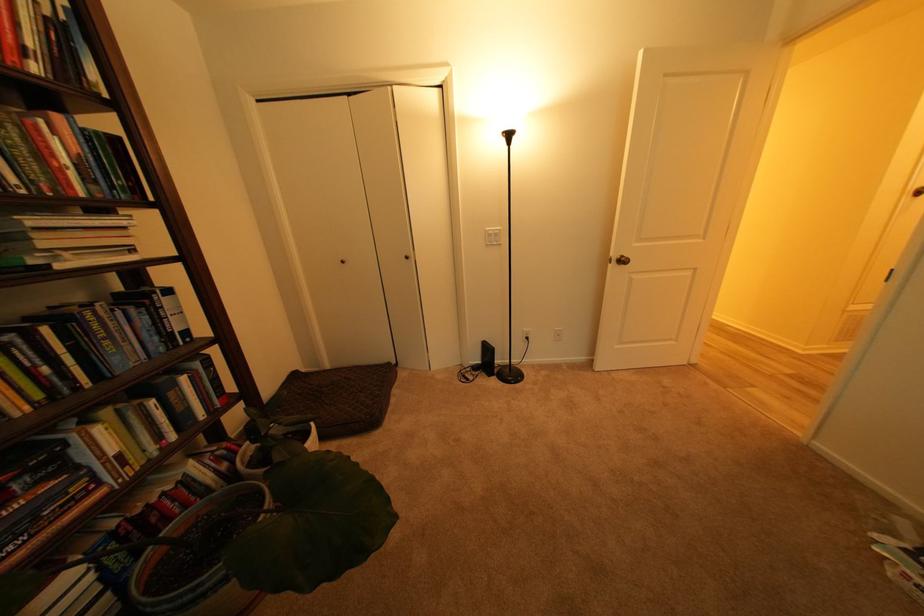
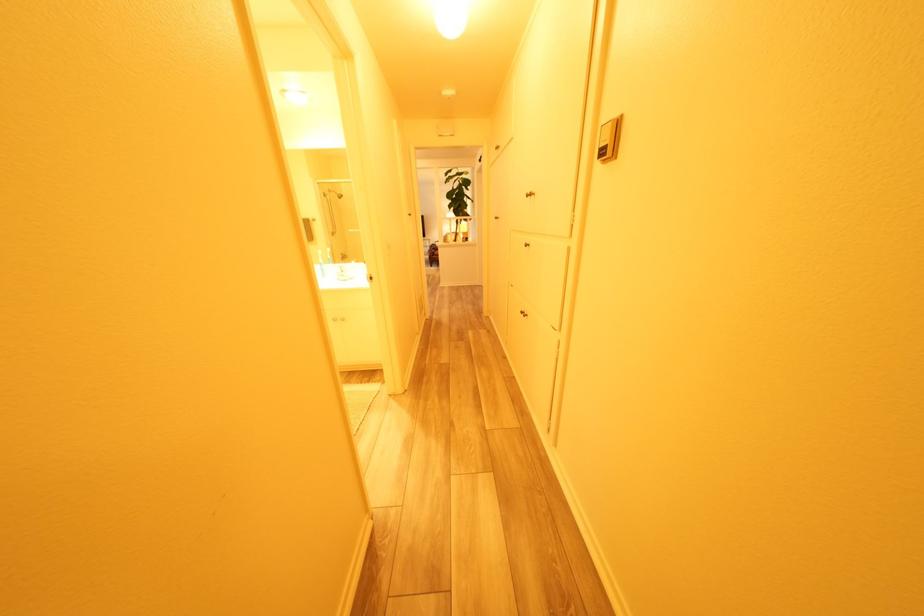
In a continuous first-person perspective shot, in which direction is the camera moving?

The movement direction of the cameraman is right, forward.